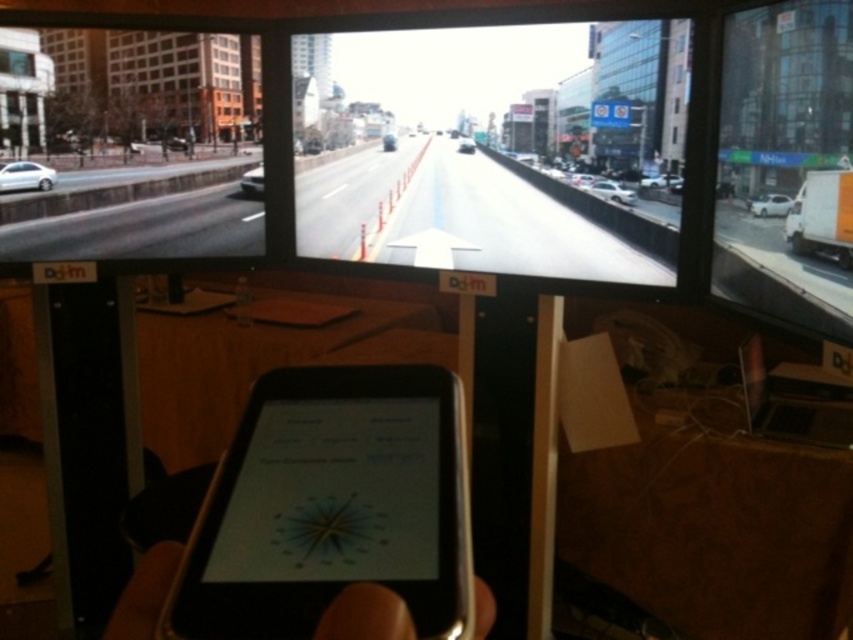
Who is positioned more to the right, matte black monitor at left or white matte car at left?

matte black monitor at left is more to the right.

The image size is (853, 640). I want to click on matte black monitor at left, so click(x=161, y=81).

Identify the location of white glossy car at center. click(x=660, y=180).

Who is lower down, white glossy car at center or white glossy sedan at center?

white glossy car at center is below.

Is point (666, 179) behind point (467, 148)?

No, it is not.

Where is `white glossy car at center`? The image size is (853, 640). white glossy car at center is located at coordinates (660, 180).

Is point (608, 180) less distant than point (390, 144)?

Yes.

Is the position of white matte car at center more distant than that of metallic silver car at center?

No.

Who is more forward, (612,193) or (390,134)?

Point (612,193)

This screenshot has width=853, height=640. What are the coordinates of `white matte car at center` in the screenshot? It's located at (612, 192).